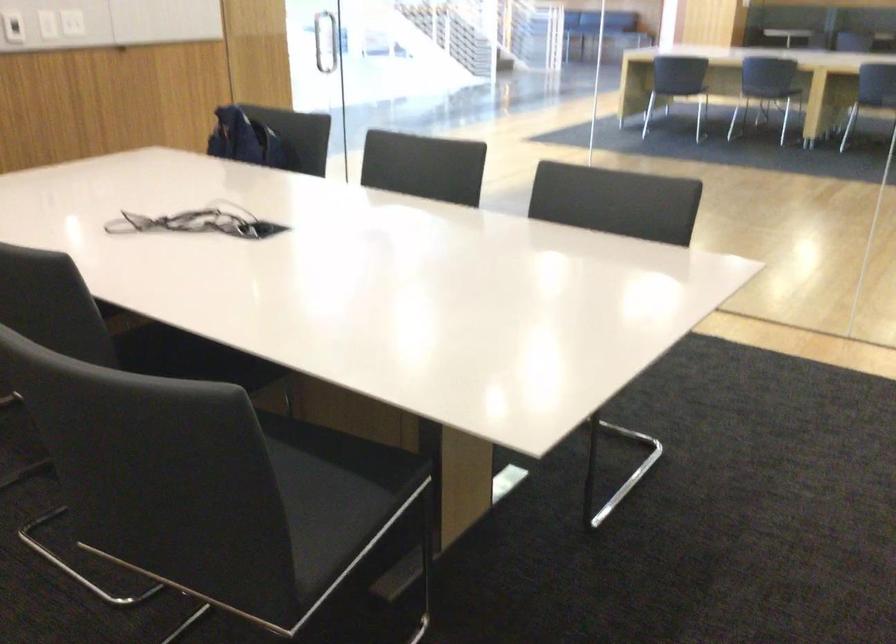
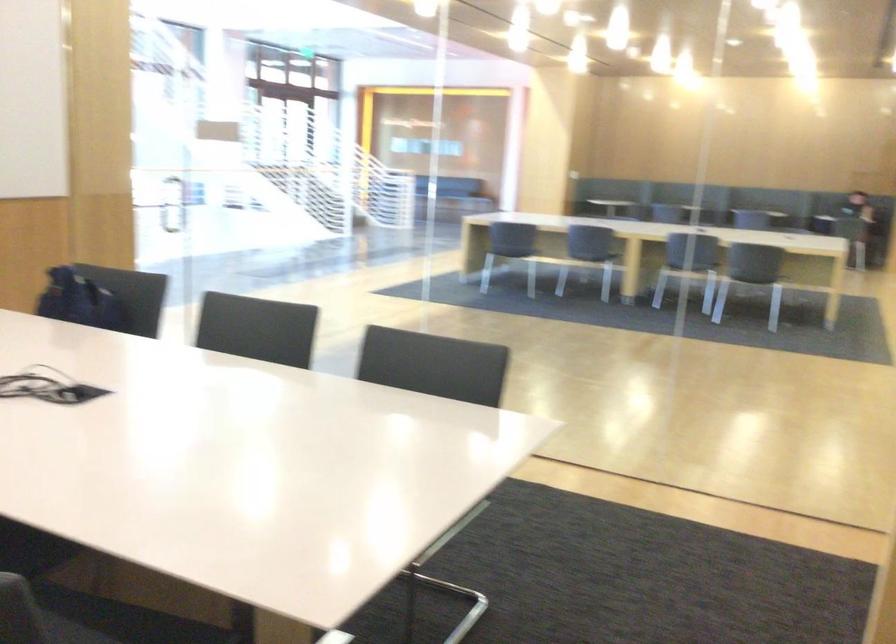
Question: Based on the continuous images, in which direction is the camera rotating? Reply with the corresponding letter.

Choices:
 (A) Left
 (B) Right
 (C) Up
 (D) Down

Answer: (B)